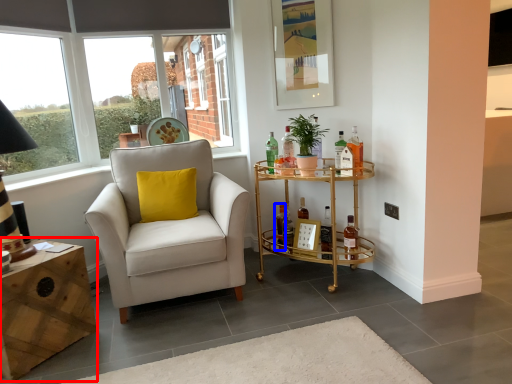
Question: Among these objects, which one is farthest to the camera, desk (highlighted by a red box) or bottle (highlighted by a blue box)?

Choices:
 (A) desk
 (B) bottle

Answer: (B)